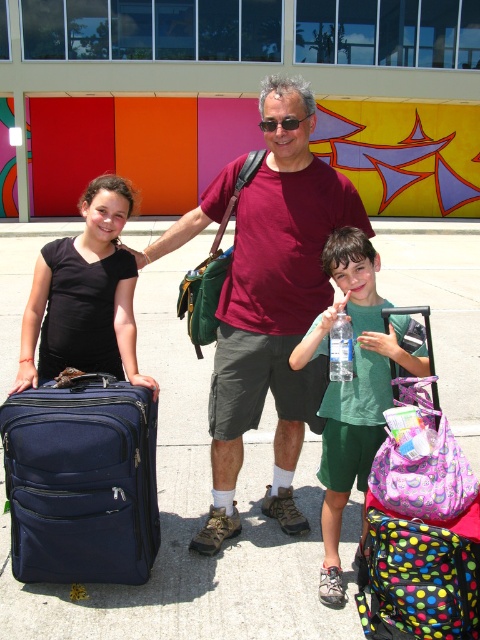
Question: Which of these objects is positioned closest to the black matte suitcase at left?

Choices:
 (A) clear plastic bottle at center
 (B) navy blue fabric suitcase at left
 (C) maroon t-shirt at center
 (D) green fabric water bottle at center

Answer: (B)

Question: Does green fabric water bottle at center have a larger size compared to black matte suitcase at left?

Choices:
 (A) no
 (B) yes

Answer: (B)

Question: Can you confirm if green fabric water bottle at center is wider than clear plastic bottle at center?

Choices:
 (A) yes
 (B) no

Answer: (A)

Question: Considering the real-world distances, which object is farthest from the black matte suitcase at left?

Choices:
 (A) clear plastic bottle at center
 (B) navy blue fabric suitcase at left
 (C) green fabric water bottle at center
 (D) maroon t-shirt at center

Answer: (C)

Question: Which object appears closest to the camera in this image?

Choices:
 (A) green fabric water bottle at center
 (B) maroon t-shirt at center
 (C) black matte suitcase at left
 (D) clear plastic bottle at center

Answer: (A)

Question: Can you confirm if green fabric water bottle at center is smaller than clear plastic bottle at center?

Choices:
 (A) no
 (B) yes

Answer: (A)